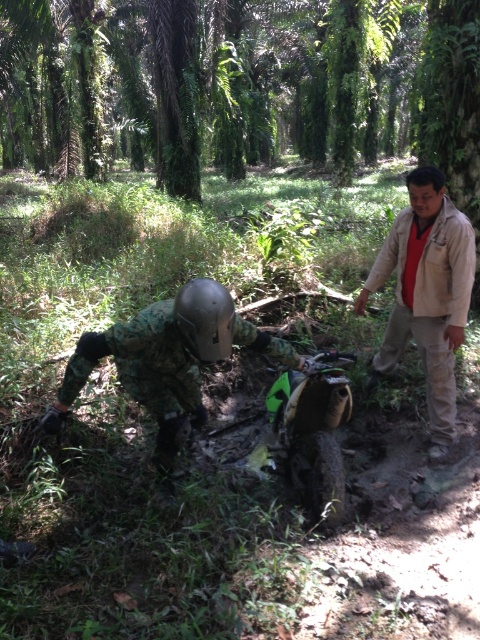
Question: Can you confirm if beige cotton shirt at upper right is smaller than metallic gray helmet at center?

Choices:
 (A) no
 (B) yes

Answer: (A)

Question: Which object is farther from the camera taking this photo?

Choices:
 (A) metallic gray helmet at center
 (B) green camouflage uniform at center

Answer: (B)

Question: Which of these objects is positioned farthest from the beige cotton shirt at upper right?

Choices:
 (A) green camouflage uniform at center
 (B) metallic gray helmet at center

Answer: (B)

Question: Does green camouflage uniform at center have a larger size compared to metallic gray helmet at center?

Choices:
 (A) yes
 (B) no

Answer: (A)

Question: Can you confirm if green camouflage uniform at center is thinner than beige cotton shirt at upper right?

Choices:
 (A) yes
 (B) no

Answer: (B)

Question: Which object is farther from the camera taking this photo?

Choices:
 (A) beige cotton shirt at upper right
 (B) green camouflage uniform at center

Answer: (A)